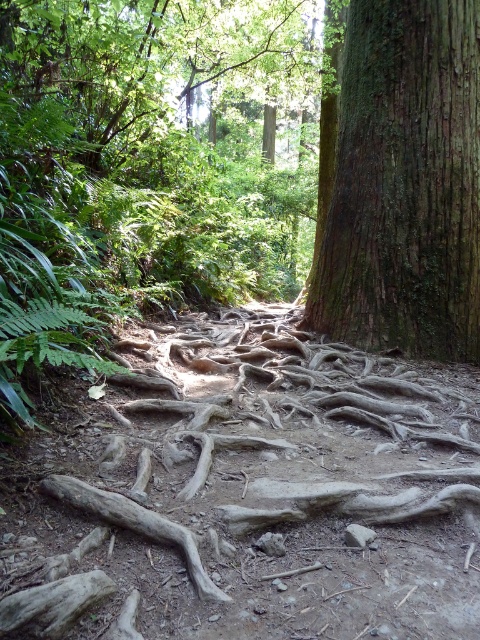
Between green rough bark tree trunk at center and brown rough tree root at lower left, which one is positioned higher?

green rough bark tree trunk at center

Is green rough bark tree trunk at center closer to camera compared to brown rough tree root at lower left?

No, green rough bark tree trunk at center is further to the viewer.

Between point (432, 268) and point (152, 529), which one is positioned in front?

Point (152, 529) is more forward.

This screenshot has height=640, width=480. Find the location of `green rough bark tree trunk at center`. green rough bark tree trunk at center is located at coordinates (405, 182).